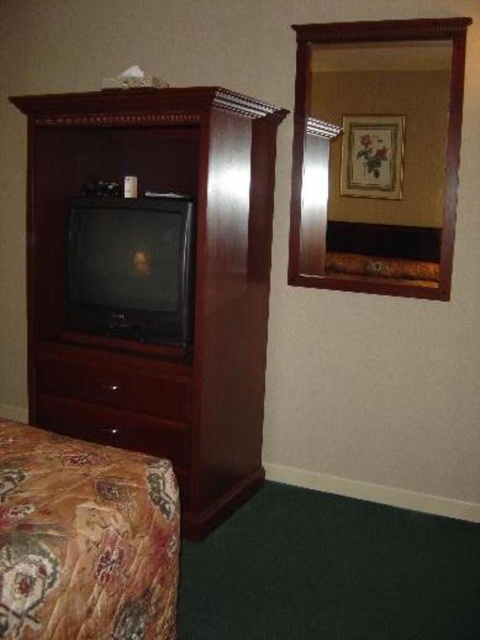
Who is positioned more to the left, mahogany wood dresser at left or floral-patterned fabric bed at lower left?

Positioned to the left is mahogany wood dresser at left.

Which is in front, point (145, 380) or point (52, 600)?

Point (52, 600) is more forward.

Does point (48, 284) lie in front of point (31, 531)?

No, it is behind (31, 531).

Where is `mahogany wood dresser at left`? mahogany wood dresser at left is located at coordinates (190, 284).